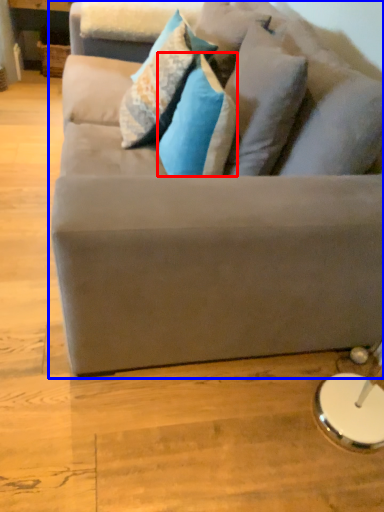
Question: Which point is further to the camera, pillow (highlighted by a red box) or studio couch (highlighted by a blue box)?

Choices:
 (A) pillow
 (B) studio couch

Answer: (A)